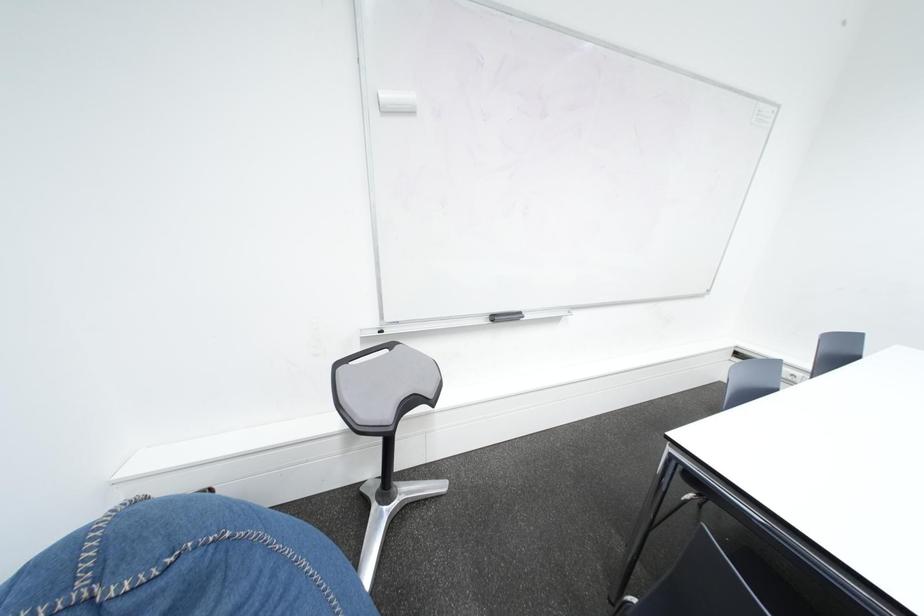
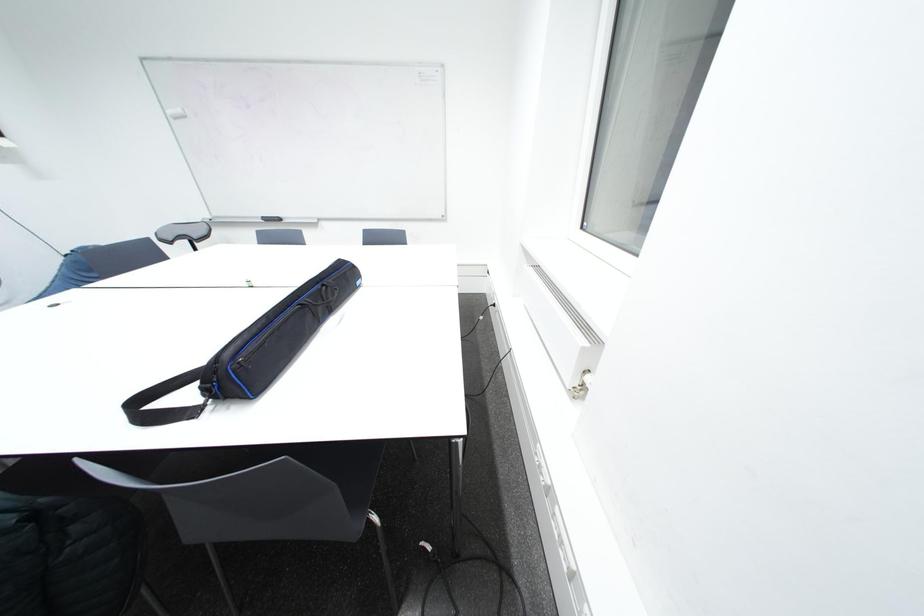
Question: The images are taken continuously from a first-person perspective. In which direction are you moving?

Choices:
 (A) Left
 (B) Right
 (C) Forward
 (D) Backward

Answer: (B)